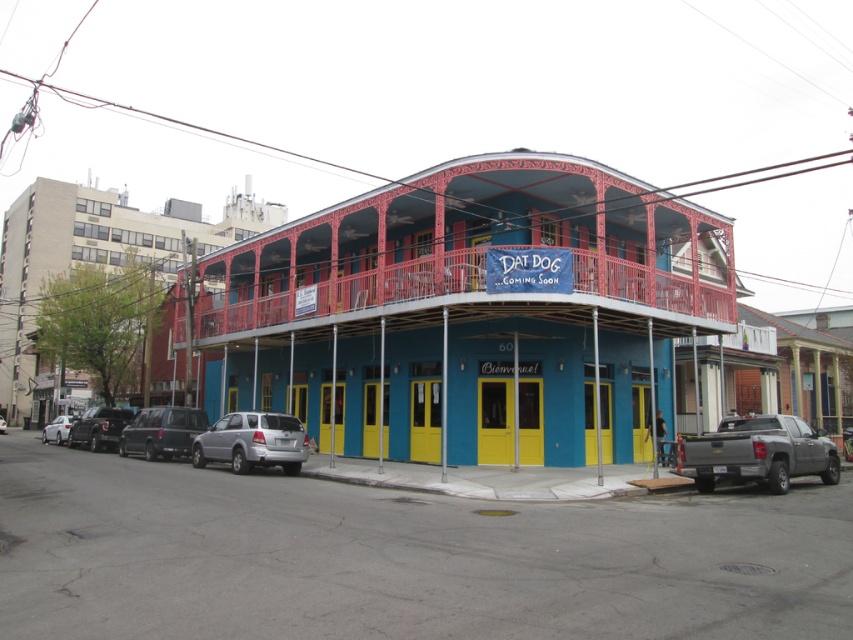
Question: Which point appears closest to the camera in this image?

Choices:
 (A) (x=723, y=300)
 (B) (x=68, y=444)
 (C) (x=239, y=452)
 (D) (x=767, y=420)

Answer: (D)

Question: Considering the relative positions of gray metallic truck at lower right and matte black truck at lower left in the image provided, where is gray metallic truck at lower right located with respect to matte black truck at lower left?

Choices:
 (A) left
 (B) right

Answer: (B)

Question: From the image, what is the correct spatial relationship of matte black van at lower left in relation to matte black truck at lower left?

Choices:
 (A) right
 (B) left

Answer: (A)

Question: Estimate the real-world distances between objects in this image. Which object is closer to the matte black van at lower left?

Choices:
 (A) silver metallic sedan at center
 (B) matte black truck at lower left
 (C) satin silver suv at lower left

Answer: (C)

Question: Which of these objects is positioned closest to the metallic red balcony at upper center?

Choices:
 (A) matte black truck at lower left
 (B) white matte car at lower left
 (C) matte black van at lower left
 (D) gray metallic truck at lower right

Answer: (C)

Question: Can you confirm if metallic red balcony at upper center is wider than matte black truck at lower left?

Choices:
 (A) yes
 (B) no

Answer: (A)